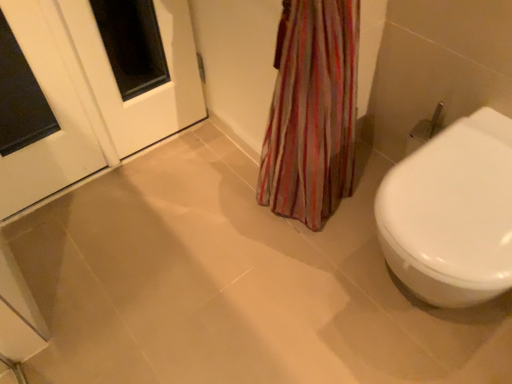
Question: Is white glossy door at upper left positioned with its back to white glossy door at upper left?

Choices:
 (A) yes
 (B) no

Answer: (B)

Question: From a real-world perspective, is white glossy door at upper left beneath white glossy door at upper left?

Choices:
 (A) yes
 (B) no

Answer: (B)

Question: Is white glossy door at upper left a part of white glossy door at upper left?

Choices:
 (A) no
 (B) yes

Answer: (A)

Question: Considering the relative positions of white glossy door at upper left and white glossy door at upper left in the image provided, is white glossy door at upper left to the right of white glossy door at upper left from the viewer's perspective?

Choices:
 (A) yes
 (B) no

Answer: (B)

Question: Is white glossy door at upper left thinner than white glossy door at upper left?

Choices:
 (A) yes
 (B) no

Answer: (A)

Question: Looking at their shapes, would you say white glossy bidet at right is wider or thinner than white glossy door at upper left?

Choices:
 (A) thin
 (B) wide

Answer: (B)

Question: Would you say white glossy bidet at right is to the left or to the right of white glossy door at upper left in the picture?

Choices:
 (A) right
 (B) left

Answer: (A)

Question: Is white glossy bidet at right situated inside white glossy door at upper left or outside?

Choices:
 (A) inside
 (B) outside

Answer: (B)

Question: In terms of height, does white glossy bidet at right look taller or shorter compared to white glossy door at upper left?

Choices:
 (A) tall
 (B) short

Answer: (B)

Question: Is white glossy door at upper left bigger or smaller than white glossy door at upper left?

Choices:
 (A) big
 (B) small

Answer: (B)

Question: From the image's perspective, is white glossy door at upper left positioned above or below white glossy door at upper left?

Choices:
 (A) below
 (B) above

Answer: (A)

Question: Is white glossy door at upper left to the left or to the right of white glossy door at upper left in the image?

Choices:
 (A) right
 (B) left

Answer: (B)

Question: Considering the positions of point [66, 178] and point [95, 91], is point [66, 178] closer or farther from the camera than point [95, 91]?

Choices:
 (A) farther
 (B) closer

Answer: (A)

Question: From a real-world perspective, is white glossy door at upper left above or below white glossy door at upper left?

Choices:
 (A) below
 (B) above

Answer: (A)

Question: Is white glossy door at upper left taller or shorter than white glossy door at upper left?

Choices:
 (A) short
 (B) tall

Answer: (A)